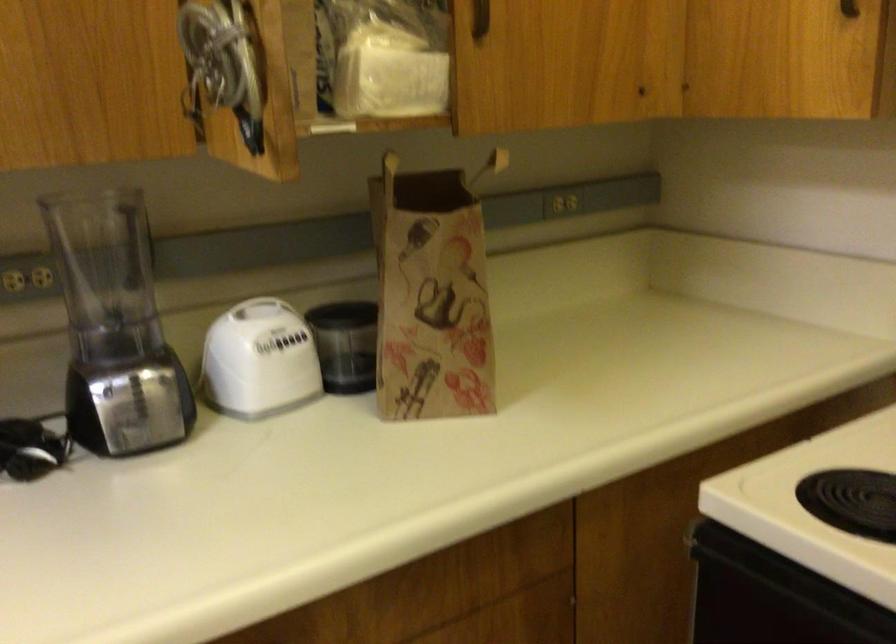
This screenshot has height=644, width=896. Describe the element at coordinates (149, 395) in the screenshot. I see `a blender control buttons` at that location.